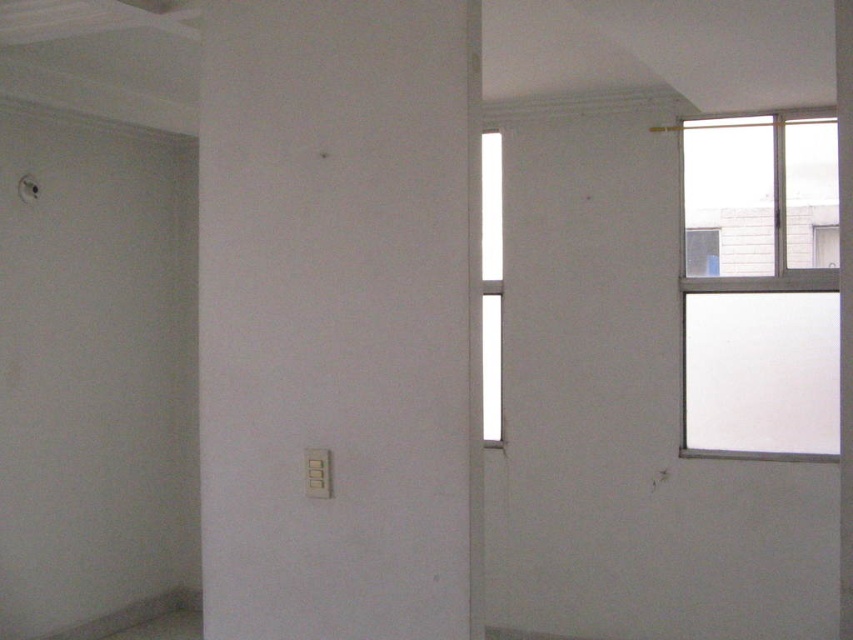
You are standing in the center of the room. Which direction should you face to look directly at the transparent glass window at upper right?

The transparent glass window at upper right is located at coordinates 0.445 on the x axis and 0.892 on the y axis, so facing towards the upper right direction would allow you to look directly at it.

You are an interior designer planning to install a new light fixture. You need to decide between placing it above the transparent glass window at upper right or the white glass window at center. Based on their positions, which window is lower and thus more suitable for the fixture to avoid blocking the upper window?

The transparent glass window at upper right is located below the white glass window at center, so it is lower. Therefore, placing the light fixture above the transparent glass window at upper right would be more suitable to avoid blocking the upper white glass window at center.